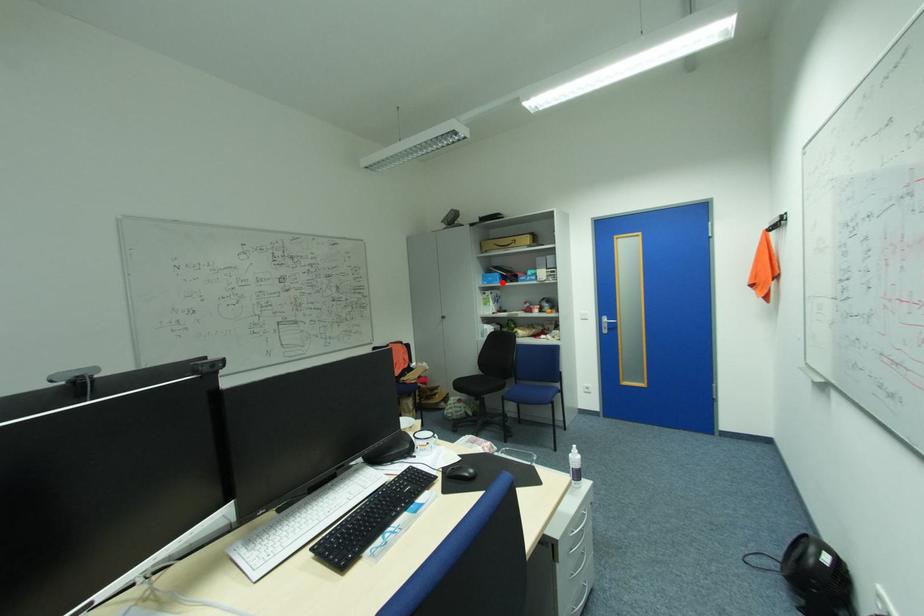
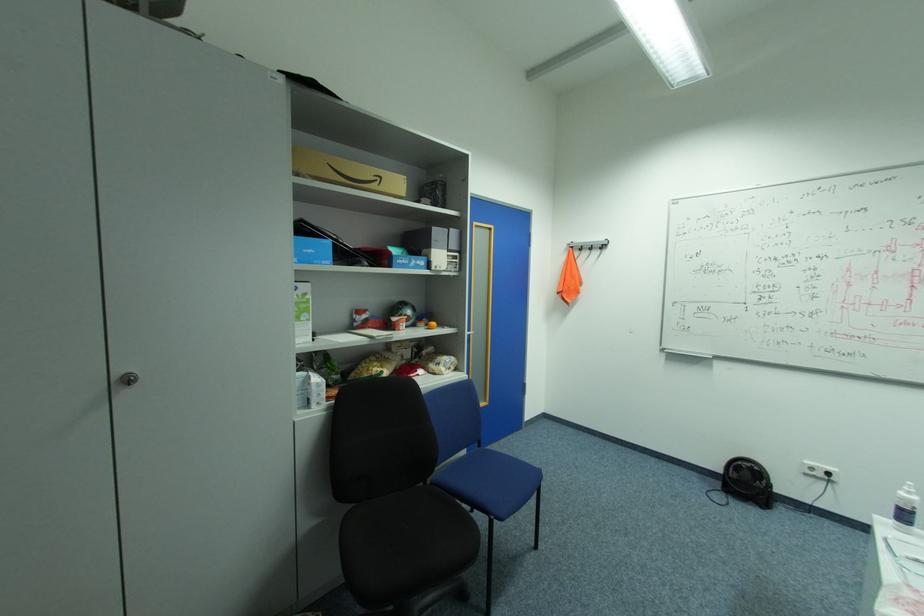
The point at the highlighted location is marked in the first image. Where is the corresponding point in the second image?

(331, 262)